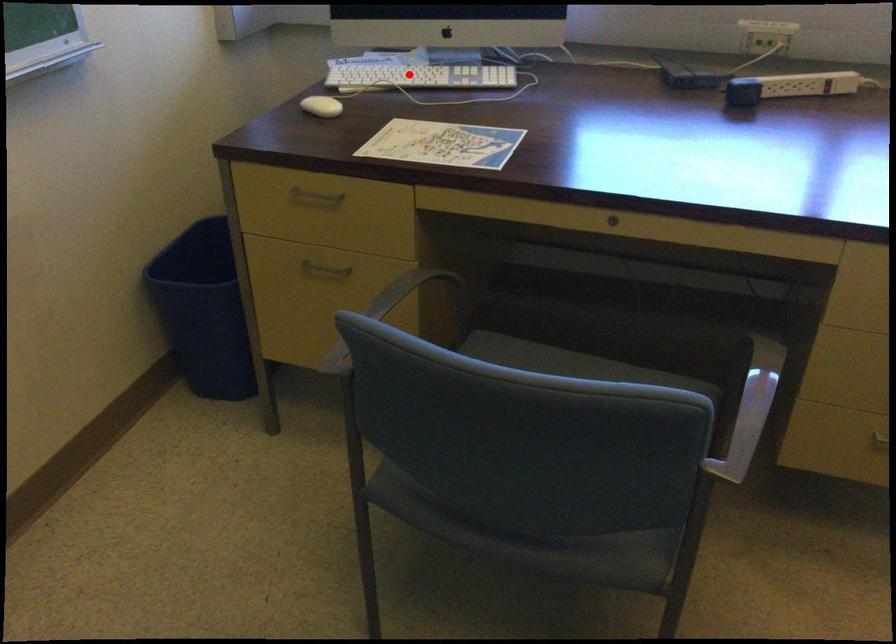
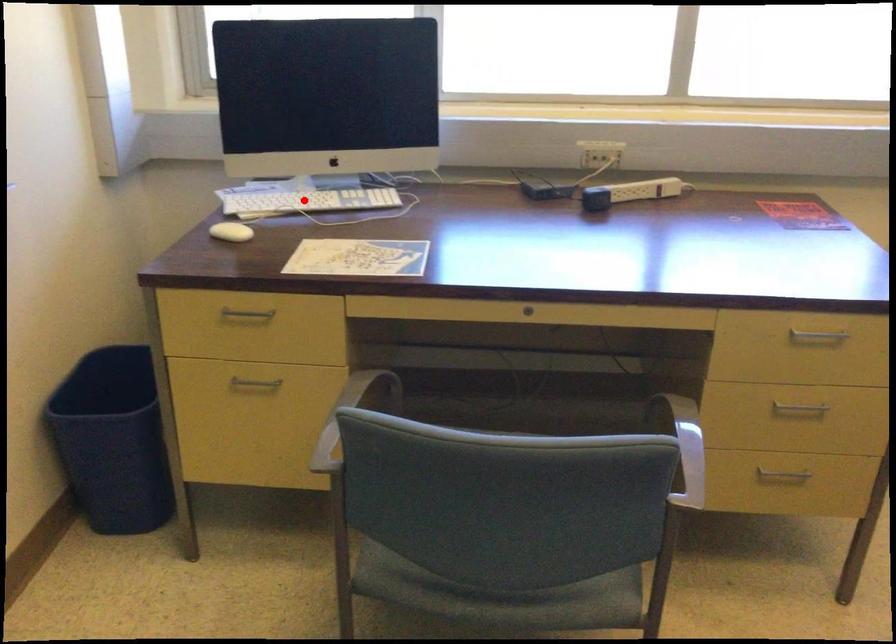
I am providing you with two images of the same scene from different viewpoints. A red point is marked on the first image and another point is marked on the second image. Are the points marked in image1 and image2 representing the same 3D position?

Yes